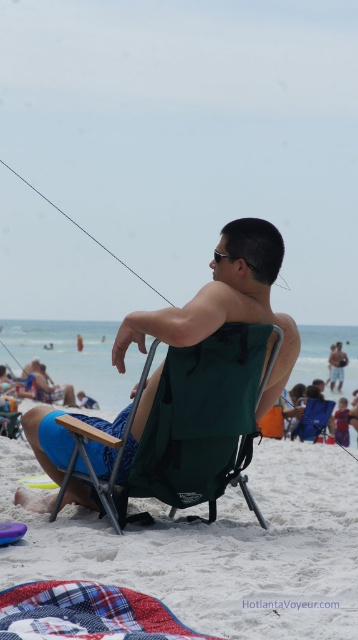
Question: Does green fabric folding chair at center have a smaller size compared to blue fabric chair at center?

Choices:
 (A) no
 (B) yes

Answer: (B)

Question: Which of the following is the farthest from the observer?

Choices:
 (A) (249, 508)
 (B) (243, 602)
 (C) (84, 228)
 (D) (307, 420)

Answer: (C)

Question: Is green fabric folding chair at center to the right of metallic wire fishing pole at upper left from the viewer's perspective?

Choices:
 (A) no
 (B) yes

Answer: (B)

Question: Considering the relative positions of blue fabric chair at center and light blue shorts at center in the image provided, where is blue fabric chair at center located with respect to light blue shorts at center?

Choices:
 (A) right
 (B) left

Answer: (B)

Question: Which point is closer to the camera?

Choices:
 (A) (320, 420)
 (B) (253, 324)

Answer: (B)

Question: Which object appears farthest from the camera in this image?

Choices:
 (A) blue fabric chair at center
 (B) green fabric folding chair at center
 (C) green fabric chair at center
 (D) metallic wire fishing pole at upper left

Answer: (A)